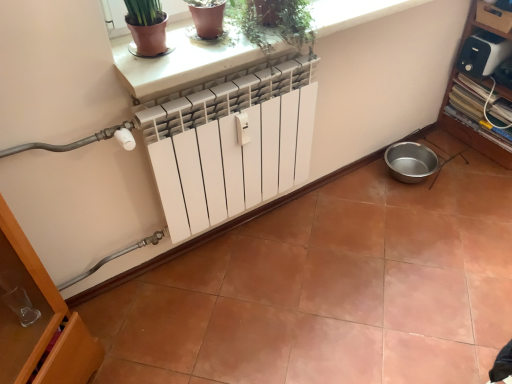
Measure the distance between metallic silver shelf at right and camera.

The distance of metallic silver shelf at right from camera is 6.14 feet.

This screenshot has height=384, width=512. What do you see at coordinates (183, 64) in the screenshot? I see `white smooth ledge at upper center` at bounding box center [183, 64].

The image size is (512, 384). I want to click on green matte plant at upper center, so click(x=275, y=22).

Can you see metallic silver shelf at right touching white plastic toaster at upper right?

metallic silver shelf at right and white plastic toaster at upper right are not in contact.

Can you tell me how much metallic silver shelf at right and white plastic toaster at upper right differ in facing direction?

The angular difference between metallic silver shelf at right and white plastic toaster at upper right is 0.000359 degrees.

Based on their sizes in the image, would you say metallic silver shelf at right is bigger or smaller than white plastic toaster at upper right?

metallic silver shelf at right is bigger than white plastic toaster at upper right.

Is metallic silver shelf at right positioned with its back to white plastic toaster at upper right?

metallic silver shelf at right does not have its back to white plastic toaster at upper right.

Is white glossy radiator at center positioned with its back to metallic silver shelf at right?

No, white glossy radiator at center is not facing away from metallic silver shelf at right.

Is white glossy radiator at center far from metallic silver shelf at right?

That's right, there is a large distance between white glossy radiator at center and metallic silver shelf at right.

In the scene shown: Who is bigger, white glossy radiator at center or metallic silver shelf at right?

metallic silver shelf at right.

Is point (499, 37) positioned after point (204, 328)?

Yes, it is behind point (204, 328).

Is white plastic toaster at upper right positioned with its back to white glossy radiator at center?

No, white plastic toaster at upper right is not facing away from white glossy radiator at center.

Is white plastic toaster at upper right in front of or behind white glossy radiator at center in the image?

white plastic toaster at upper right is positioned farther from the viewer than white glossy radiator at center.

Does white plastic toaster at upper right have a greater width compared to white glossy radiator at center?

No.

Does point (161, 77) appear closer or farther from the camera than point (463, 127)?

Point (161, 77) appears to be closer to the viewer than point (463, 127).

From a real-world perspective, between white smooth ledge at upper center and metallic silver shelf at right, who is vertically higher?

white smooth ledge at upper center is physically above.

Is white smooth ledge at upper center in front of metallic silver shelf at right?

Yes.

Is white smooth ledge at upper center turned away from metallic silver shelf at right?

No, white smooth ledge at upper center is not facing away from metallic silver shelf at right.

Is point (487, 144) closer to viewer compared to point (138, 83)?

No, (487, 144) is behind (138, 83).

Is metallic silver shelf at right not near white smooth ledge at upper center?

That's right, there is a large distance between metallic silver shelf at right and white smooth ledge at upper center.

Does metallic silver shelf at right turn towards white smooth ledge at upper center?

No, metallic silver shelf at right does not turn towards white smooth ledge at upper center.

This screenshot has width=512, height=384. Find the location of `shelf above the green matte plant at upper center (from the image's perspective)`. shelf above the green matte plant at upper center (from the image's perspective) is located at coordinates coord(471,132).

Does green matte plant at upper center have a smaller size compared to metallic silver shelf at right?

Yes.

Which object is positioned more to the right, green matte plant at upper center or metallic silver shelf at right?

From the viewer's perspective, metallic silver shelf at right appears more on the right side.

In the image, is white plastic toaster at upper right on the left side or the right side of metallic silver shelf at right?

Based on their positions, white plastic toaster at upper right is located to the left of metallic silver shelf at right.

Find the location of `shelf on the right side of white plastic toaster at upper right`. shelf on the right side of white plastic toaster at upper right is located at coordinates (471, 132).

From the image's perspective, which is below, white plastic toaster at upper right or metallic silver shelf at right?

white plastic toaster at upper right is shown below in the image.

Where is `shelf that appears in front of the white plastic toaster at upper right`? shelf that appears in front of the white plastic toaster at upper right is located at coordinates (471, 132).

You are a GUI agent. You are given a task and a screenshot of the screen. Output one action in this format:
    pyautogui.click(x=<x>, y=<y>)
    Task: Click on the shelf located behind the white glossy radiator at center
    This screenshot has width=512, height=384.
    Given the screenshot: What is the action you would take?
    pyautogui.click(x=471, y=132)

From the image, which object appears to be nearer to white plastic toaster at upper right, green matte plant at upper center or white smooth ledge at upper center?

white smooth ledge at upper center is closer to white plastic toaster at upper right.

Considering their positions, is white plastic toaster at upper right positioned closer to metallic silver shelf at right than white glossy radiator at center?

white plastic toaster at upper right lies closer to metallic silver shelf at right than the other object.

Estimate the real-world distances between objects in this image. Which object is closer to white glossy radiator at center, white smooth ledge at upper center or white plastic toaster at upper right?

Among the two, white smooth ledge at upper center is located nearer to white glossy radiator at center.

Consider the image. Estimate the real-world distances between objects in this image. Which object is closer to green matte plant at upper center, metallic silver shelf at right or white glossy radiator at center?

white glossy radiator at center is closer to green matte plant at upper center.

Considering their positions, is metallic silver shelf at right positioned closer to white smooth ledge at upper center than white glossy radiator at center?

white glossy radiator at center.

From the image, which object appears to be nearer to green matte plant at upper center, white glossy radiator at center or white smooth ledge at upper center?

Among the two, white smooth ledge at upper center is located nearer to green matte plant at upper center.

Based on their spatial positions, is green matte plant at upper center or white glossy radiator at center closer to white plastic toaster at upper right?

white glossy radiator at center.

Based on the photo, estimate the real-world distances between objects in this image. Which object is closer to white smooth ledge at upper center, white plastic toaster at upper right or white glossy radiator at center?

The object closer to white smooth ledge at upper center is white glossy radiator at center.

Image resolution: width=512 pixels, height=384 pixels. Find the location of `ledge between green matte plant at upper center and white plastic toaster at upper right from left to right`. ledge between green matte plant at upper center and white plastic toaster at upper right from left to right is located at coordinates [x=183, y=64].

You are a GUI agent. You are given a task and a screenshot of the screen. Output one action in this format:
    pyautogui.click(x=<x>, y=<y>)
    Task: Click on the houseplant between white smooth ledge at upper center and white glossy radiator at center from top to bottom
    This screenshot has height=384, width=512.
    Given the screenshot: What is the action you would take?
    pyautogui.click(x=275, y=22)

In order to click on appliance that lies between metallic silver shelf at right and white glossy radiator at center from top to bottom in this screenshot , I will do `click(483, 54)`.

Where is `appliance between green matte plant at upper center and metallic silver shelf at right from left to right`? The image size is (512, 384). appliance between green matte plant at upper center and metallic silver shelf at right from left to right is located at coordinates (483, 54).